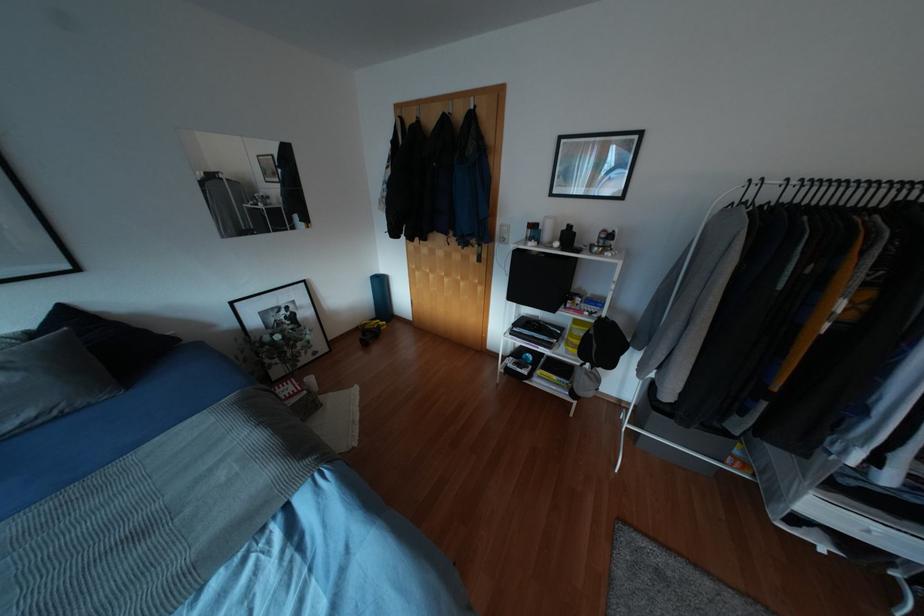
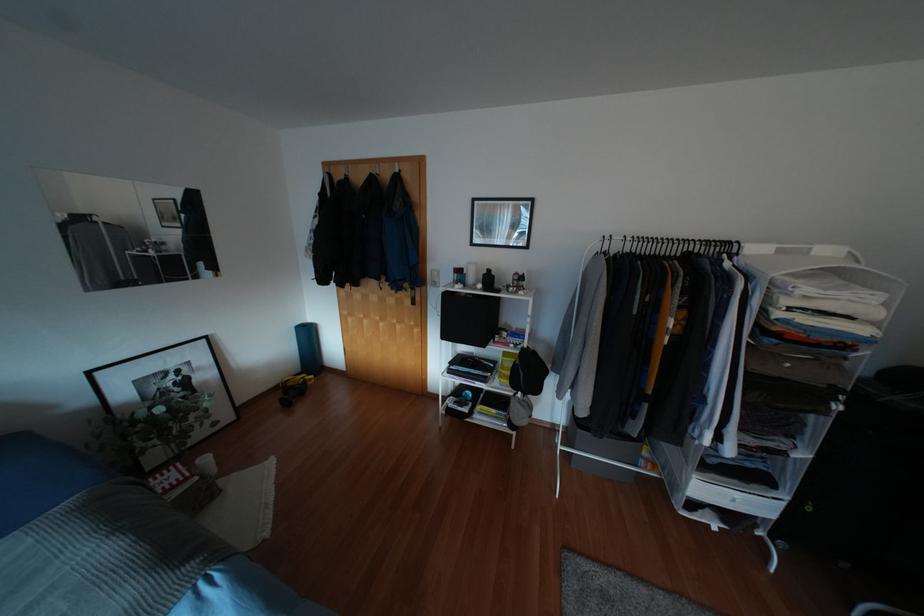
The point at (481, 111) is marked in the first image. Where is the corresponding point in the second image?

(406, 176)